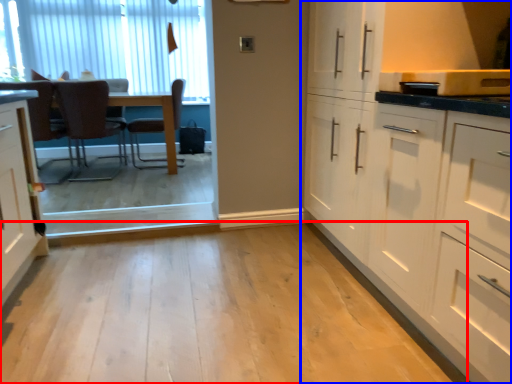
Question: Which object appears closest to the camera in this image, plain (highlighted by a red box) or cabinetry (highlighted by a blue box)?

Choices:
 (A) plain
 (B) cabinetry

Answer: (A)